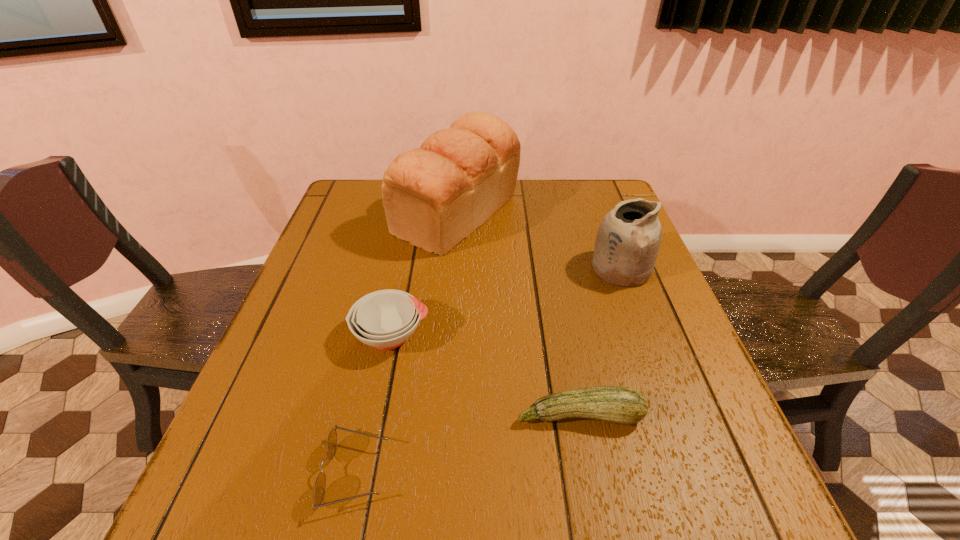
At what (x,y) coordinates should I click in order to perform the action: click on unoccupied position between the spectacles and the tallest object. Please return your answer as a coordinate pair (x, y). The image size is (960, 540). Looking at the image, I should click on (406, 343).

This screenshot has width=960, height=540. In order to click on object that is the fourth closest one to the soup bowl in this screenshot , I will do `click(627, 243)`.

Where is `object that is the third closest one to the shortest object`? This screenshot has height=540, width=960. object that is the third closest one to the shortest object is located at coordinates (434, 196).

Find the location of `free space that satisfies the following two spatial constraints: 1. on the front side of the bread; 2. on the right side of the pottery`. free space that satisfies the following two spatial constraints: 1. on the front side of the bread; 2. on the right side of the pottery is located at coordinates (452, 269).

Identify the location of vacant space that satisfies the following two spatial constraints: 1. at the stem end of the zucchini; 2. on the front-facing side of the spectacles. Image resolution: width=960 pixels, height=540 pixels. (590, 473).

Where is `vacant space that satisfies the following two spatial constraints: 1. at the stem end of the zucchini; 2. on the front-facing side of the nearest object`? vacant space that satisfies the following two spatial constraints: 1. at the stem end of the zucchini; 2. on the front-facing side of the nearest object is located at coordinates (590, 473).

At what (x,y) coordinates should I click in order to perform the action: click on free point that satisfies the following two spatial constraints: 1. on the back side of the soup bowl; 2. on the right side of the tallest object. Please return your answer as a coordinate pair (x, y). Image resolution: width=960 pixels, height=540 pixels. Looking at the image, I should click on (416, 214).